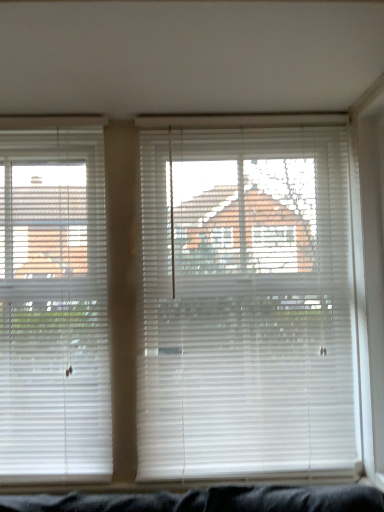
What do you see at coordinates (246, 304) in the screenshot?
I see `white plastic blinds at center, the first window blind from the right` at bounding box center [246, 304].

The height and width of the screenshot is (512, 384). Identify the location of white plastic blinds at center, the 2th window blind when ordered from left to right. [x=246, y=304].

How much space does white plastic blinds at left, marked as the 2th window blind in a right-to-left arrangement, occupy vertically?

It is 1.51 meters.

Find the location of a particular element. Image resolution: width=384 pixels, height=512 pixels. white plastic blinds at left, positioned as the 1th window blind in left-to-right order is located at coordinates (53, 305).

This screenshot has height=512, width=384. What do you see at coordinates (53, 305) in the screenshot?
I see `white plastic blinds at left, marked as the 2th window blind in a right-to-left arrangement` at bounding box center [53, 305].

Find the location of a particular element. Image resolution: width=384 pixels, height=512 pixels. white plastic blinds at center, the first window blind from the right is located at coordinates (246, 304).

Can you confirm if white plastic blinds at center, the first window blind from the right, is positioned to the right of white plastic blinds at left, marked as the 2th window blind in a right-to-left arrangement?

Yes.

Based on the photo, is white plastic blinds at center, the first window blind from the right, closer to the viewer compared to white plastic blinds at left, positioned as the 1th window blind in left-to-right order?

That is True.

Considering the points (194, 179) and (14, 376), which point is in front, point (194, 179) or point (14, 376)?

The point (14, 376) is closer.

From the image's perspective, does white plastic blinds at center, the 2th window blind when ordered from left to right, appear higher than white plastic blinds at left, marked as the 2th window blind in a right-to-left arrangement?

Yes.

From the picture: From a real-world perspective, relative to white plastic blinds at left, marked as the 2th window blind in a right-to-left arrangement, is white plastic blinds at center, the 2th window blind when ordered from left to right, vertically above or below?

white plastic blinds at center, the 2th window blind when ordered from left to right, is below white plastic blinds at left, marked as the 2th window blind in a right-to-left arrangement.

Considering the relative sizes of white plastic blinds at center, the 2th window blind when ordered from left to right, and white plastic blinds at left, marked as the 2th window blind in a right-to-left arrangement, in the image provided, is white plastic blinds at center, the 2th window blind when ordered from left to right, thinner than white plastic blinds at left, marked as the 2th window blind in a right-to-left arrangement,?

Incorrect, the width of white plastic blinds at center, the 2th window blind when ordered from left to right, is not less than that of white plastic blinds at left, marked as the 2th window blind in a right-to-left arrangement.

Between white plastic blinds at center, the 2th window blind when ordered from left to right, and white plastic blinds at left, marked as the 2th window blind in a right-to-left arrangement, which one has more height?

white plastic blinds at left, marked as the 2th window blind in a right-to-left arrangement.

Considering the relative sizes of white plastic blinds at center, the first window blind from the right, and white plastic blinds at left, positioned as the 1th window blind in left-to-right order, in the image provided, is white plastic blinds at center, the first window blind from the right, smaller than white plastic blinds at left, positioned as the 1th window blind in left-to-right order,?

No.

Is white plastic blinds at center, the 2th window blind when ordered from left to right, positioned beyond the bounds of white plastic blinds at left, marked as the 2th window blind in a right-to-left arrangement?

Yes, white plastic blinds at center, the 2th window blind when ordered from left to right, is located beyond the bounds of white plastic blinds at left, marked as the 2th window blind in a right-to-left arrangement.

Is white plastic blinds at center, the first window blind from the right, with white plastic blinds at left, marked as the 2th window blind in a right-to-left arrangement?

No, white plastic blinds at center, the first window blind from the right, is not with white plastic blinds at left, marked as the 2th window blind in a right-to-left arrangement.

Consider the image. Is white plastic blinds at left, marked as the 2th window blind in a right-to-left arrangement, at the back of white plastic blinds at center, the 2th window blind when ordered from left to right?

white plastic blinds at center, the 2th window blind when ordered from left to right, is not turned away from white plastic blinds at left, marked as the 2th window blind in a right-to-left arrangement.

How different are the orientations of white plastic blinds at center, the 2th window blind when ordered from left to right, and white plastic blinds at left, marked as the 2th window blind in a right-to-left arrangement, in degrees?

The facing directions of white plastic blinds at center, the 2th window blind when ordered from left to right, and white plastic blinds at left, marked as the 2th window blind in a right-to-left arrangement, are 0.000377 degrees apart.

Measure the distance from white plastic blinds at center, the 2th window blind when ordered from left to right, to white plastic blinds at left, positioned as the 1th window blind in left-to-right order.

white plastic blinds at center, the 2th window blind when ordered from left to right, and white plastic blinds at left, positioned as the 1th window blind in left-to-right order, are 20.04 inches apart.

This screenshot has height=512, width=384. I want to click on window blind below the white plastic blinds at left, marked as the 2th window blind in a right-to-left arrangement (from a real-world perspective), so click(x=246, y=304).

Considering the positions of objects white plastic blinds at left, marked as the 2th window blind in a right-to-left arrangement, and white plastic blinds at center, the 2th window blind when ordered from left to right, in the image provided, who is more to the left, white plastic blinds at left, marked as the 2th window blind in a right-to-left arrangement, or white plastic blinds at center, the 2th window blind when ordered from left to right,?

white plastic blinds at left, marked as the 2th window blind in a right-to-left arrangement.

Is white plastic blinds at left, marked as the 2th window blind in a right-to-left arrangement, closer to camera compared to white plastic blinds at center, the first window blind from the right?

That is False.

Which point is more distant from viewer, (104, 221) or (188, 152)?

The point (188, 152) is more distant.

From the image's perspective, is white plastic blinds at left, positioned as the 1th window blind in left-to-right order, above white plastic blinds at center, the 2th window blind when ordered from left to right?

Actually, white plastic blinds at left, positioned as the 1th window blind in left-to-right order, appears below white plastic blinds at center, the 2th window blind when ordered from left to right, in the image.

From a real-world perspective, is white plastic blinds at left, marked as the 2th window blind in a right-to-left arrangement, below white plastic blinds at center, the first window blind from the right?

No, from a real-world perspective, white plastic blinds at left, marked as the 2th window blind in a right-to-left arrangement, is not under white plastic blinds at center, the first window blind from the right.

Which object is thinner, white plastic blinds at left, positioned as the 1th window blind in left-to-right order, or white plastic blinds at center, the 2th window blind when ordered from left to right?

white plastic blinds at left, positioned as the 1th window blind in left-to-right order, is thinner.

Considering the relative sizes of white plastic blinds at left, positioned as the 1th window blind in left-to-right order, and white plastic blinds at center, the 2th window blind when ordered from left to right, in the image provided, is white plastic blinds at left, positioned as the 1th window blind in left-to-right order, taller than white plastic blinds at center, the 2th window blind when ordered from left to right,?

Yes, white plastic blinds at left, positioned as the 1th window blind in left-to-right order, is taller than white plastic blinds at center, the 2th window blind when ordered from left to right.

Does white plastic blinds at left, marked as the 2th window blind in a right-to-left arrangement, have a larger size compared to white plastic blinds at center, the first window blind from the right?

No.

Is white plastic blinds at center, the 2th window blind when ordered from left to right, a part of white plastic blinds at left, marked as the 2th window blind in a right-to-left arrangement?

No, white plastic blinds at center, the 2th window blind when ordered from left to right, is not a part of white plastic blinds at left, marked as the 2th window blind in a right-to-left arrangement.

Is white plastic blinds at left, marked as the 2th window blind in a right-to-left arrangement, beside white plastic blinds at center, the first window blind from the right?

No, white plastic blinds at left, marked as the 2th window blind in a right-to-left arrangement, is not making contact with white plastic blinds at center, the first window blind from the right.

Is white plastic blinds at left, marked as the 2th window blind in a right-to-left arrangement, turned away from white plastic blinds at center, the first window blind from the right?

That's not correct — white plastic blinds at left, marked as the 2th window blind in a right-to-left arrangement, is not looking away from white plastic blinds at center, the first window blind from the right.

How different are the orientations of white plastic blinds at left, positioned as the 1th window blind in left-to-right order, and white plastic blinds at center, the first window blind from the right, in degrees?

The angle between the facing direction of white plastic blinds at left, positioned as the 1th window blind in left-to-right order, and the facing direction of white plastic blinds at center, the first window blind from the right, is 0.000377 degrees.

How far apart are white plastic blinds at left, marked as the 2th window blind in a right-to-left arrangement, and white plastic blinds at center, the first window blind from the right?

white plastic blinds at left, marked as the 2th window blind in a right-to-left arrangement, is 50.91 centimeters from white plastic blinds at center, the first window blind from the right.

Locate an element on the screen. The image size is (384, 512). window blind in front of the white plastic blinds at left, marked as the 2th window blind in a right-to-left arrangement is located at coordinates point(246,304).

You are a GUI agent. You are given a task and a screenshot of the screen. Output one action in this format:
    pyautogui.click(x=<x>, y=<y>)
    Task: Click on the window blind below the white plastic blinds at left, marked as the 2th window blind in a right-to-left arrangement (from a real-world perspective)
    The width and height of the screenshot is (384, 512).
    Given the screenshot: What is the action you would take?
    pyautogui.click(x=246, y=304)

At what (x,y) coordinates should I click in order to perform the action: click on window blind that is behind the white plastic blinds at center, the 2th window blind when ordered from left to right. Please return your answer as a coordinate pair (x, y). Looking at the image, I should click on (53, 305).